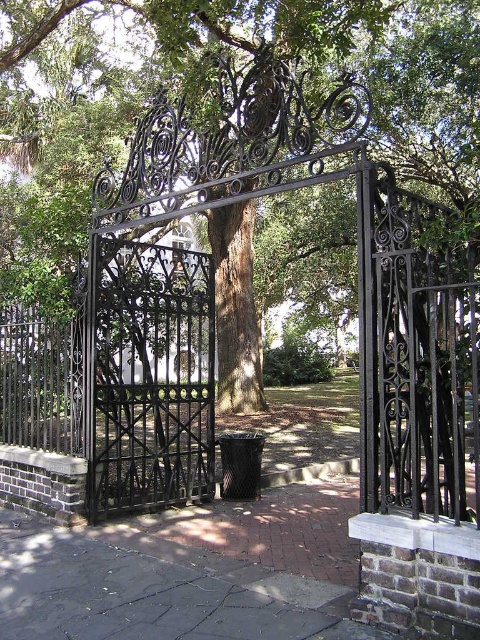
You are a landscape architect designing a pathway that must pass between the green leafy tree at center and the black wrought iron gate at center. If the pathway needs to be at least 1 meter wide, can it fit between them?

The green leafy tree at center is wider than the black wrought iron gate at center. Since the pathway requires at least 1 meter of width, it depends on the actual widths. However, the description only states the tree is wider, not the exact measurements. Without specific dimensions, we cannot confirm if the pathway will fit. Please provide more details.

You are standing at the entrance of the park and see the wrought iron gate with intricate designs. There is a point marked at coordinates (324, 60). What object is located at this point?

The point at coordinates (324, 60) marks the location of a green leafy tree at center.